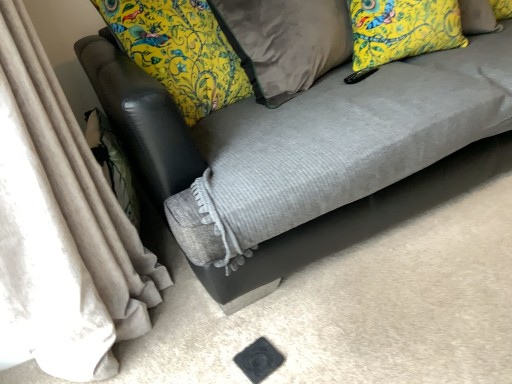
Identify the location of velvet brown pillow at center, the 2th pillow in the right-to-left sequence. Image resolution: width=512 pixels, height=384 pixels. (285, 42).

The height and width of the screenshot is (384, 512). Describe the element at coordinates (285, 42) in the screenshot. I see `velvet brown pillow at center, the 2th pillow in the right-to-left sequence` at that location.

Find the location of a particular element. Image resolution: width=512 pixels, height=384 pixels. velvet gray curtain at left is located at coordinates (61, 227).

Measure the distance between point (x=194, y=176) and camera.

Point (x=194, y=176) is 1.15 meters away from camera.

Find the location of a particular element. This screenshot has width=512, height=384. velvet brown pillow at center, the 2th pillow in the right-to-left sequence is located at coordinates (285, 42).

Considering the relative positions of textured gray couch at center and yellow floral fabric pillow at upper right, the 2th pillow positioned from the left, in the image provided, is textured gray couch at center to the left of yellow floral fabric pillow at upper right, the 2th pillow positioned from the left, from the viewer's perspective?

Incorrect, textured gray couch at center is not on the left side of yellow floral fabric pillow at upper right, the 2th pillow positioned from the left.

Who is taller, textured gray couch at center or yellow floral fabric pillow at upper right, the 1th pillow viewed from the right?

textured gray couch at center is taller.

Which point is more distant from viewer, [170,218] or [387,30]?

The point [387,30] is farther.

Which of these two, velvet gray curtain at left or textured gray couch at center, is wider?

textured gray couch at center is wider.

Is velvet gray curtain at left facing away from textured gray couch at center?

velvet gray curtain at left is not turned away from textured gray couch at center.

From a real-world perspective, is velvet gray curtain at left over textured gray couch at center?

Correct, in the physical world, velvet gray curtain at left is higher than textured gray couch at center.

Is velvet gray curtain at left at the right side of textured gray couch at center?

No, velvet gray curtain at left is not to the right of textured gray couch at center.

Is velvet brown pillow at center, the 2th pillow in the right-to-left sequence, facing away from yellow floral fabric pillow at upper right, the 1th pillow viewed from the right?

That's not correct — velvet brown pillow at center, the 2th pillow in the right-to-left sequence, is not looking away from yellow floral fabric pillow at upper right, the 1th pillow viewed from the right.

Based on the photo, what's the angular difference between velvet brown pillow at center, the 2th pillow in the right-to-left sequence, and yellow floral fabric pillow at upper right, the 1th pillow viewed from the right,'s facing directions?

There is a 41.3-degree angle between the facing directions of velvet brown pillow at center, the 2th pillow in the right-to-left sequence, and yellow floral fabric pillow at upper right, the 1th pillow viewed from the right.

Consider the image. From a real-world perspective, between velvet brown pillow at center, marked as the 1th pillow in a left-to-right arrangement, and yellow floral fabric pillow at upper right, the 2th pillow positioned from the left, who is vertically higher?

yellow floral fabric pillow at upper right, the 2th pillow positioned from the left, is physically above.

Considering the relative sizes of velvet brown pillow at center, the 2th pillow in the right-to-left sequence, and yellow floral fabric pillow at upper right, the 1th pillow viewed from the right, in the image provided, is velvet brown pillow at center, the 2th pillow in the right-to-left sequence, shorter than yellow floral fabric pillow at upper right, the 1th pillow viewed from the right,?

No, velvet brown pillow at center, the 2th pillow in the right-to-left sequence, is not shorter than yellow floral fabric pillow at upper right, the 1th pillow viewed from the right.

Looking at the image, does yellow floral fabric pillow at upper right, the 2th pillow positioned from the left, seem bigger or smaller compared to velvet gray curtain at left?

yellow floral fabric pillow at upper right, the 2th pillow positioned from the left, is smaller than velvet gray curtain at left.

Considering the sizes of yellow floral fabric pillow at upper right, the 2th pillow positioned from the left, and velvet gray curtain at left in the image, is yellow floral fabric pillow at upper right, the 2th pillow positioned from the left, taller or shorter than velvet gray curtain at left?

Considering their sizes, yellow floral fabric pillow at upper right, the 2th pillow positioned from the left, has less height than velvet gray curtain at left.

How different are the orientations of yellow floral fabric pillow at upper right, the 1th pillow viewed from the right, and velvet gray curtain at left in degrees?

There is a 99.7-degree angle between the facing directions of yellow floral fabric pillow at upper right, the 1th pillow viewed from the right, and velvet gray curtain at left.

Would you consider yellow floral fabric pillow at upper right, the 2th pillow positioned from the left, to be distant from velvet gray curtain at left?

Absolutely, yellow floral fabric pillow at upper right, the 2th pillow positioned from the left, is distant from velvet gray curtain at left.

Based on their positions, is yellow floral fabric pillow at upper right, the 2th pillow positioned from the left, located to the left or right of textured gray couch at center?

Based on their positions, yellow floral fabric pillow at upper right, the 2th pillow positioned from the left, is located to the left of textured gray couch at center.

Consider the image. Is the position of yellow floral fabric pillow at upper right, the 2th pillow positioned from the left, less distant than that of textured gray couch at center?

No, it is behind textured gray couch at center.

Is yellow floral fabric pillow at upper right, the 1th pillow viewed from the right, bigger than textured gray couch at center?

No, yellow floral fabric pillow at upper right, the 1th pillow viewed from the right, is not bigger than textured gray couch at center.

Is yellow floral fabric pillow at upper right, the 2th pillow positioned from the left, far away from textured gray couch at center?

No.

What's the angular difference between textured gray couch at center and velvet brown pillow at center, marked as the 1th pillow in a left-to-right arrangement,'s facing directions?

The angle between the facing direction of textured gray couch at center and the facing direction of velvet brown pillow at center, marked as the 1th pillow in a left-to-right arrangement, is 28.2 degrees.

Does textured gray couch at center turn towards velvet brown pillow at center, the 2th pillow in the right-to-left sequence?

Yes, textured gray couch at center is oriented towards velvet brown pillow at center, the 2th pillow in the right-to-left sequence.

Which is closer, (396,143) or (268,42)?

Point (396,143).

Can you confirm if textured gray couch at center is positioned to the right of velvet brown pillow at center, marked as the 1th pillow in a left-to-right arrangement?

Indeed, textured gray couch at center is positioned on the right side of velvet brown pillow at center, marked as the 1th pillow in a left-to-right arrangement.

Is point (411, 25) closer or farther from the camera than point (257, 65)?

Point (411, 25).

Considering their positions, is yellow floral fabric pillow at upper right, the 1th pillow viewed from the right, located in front of or behind velvet brown pillow at center, marked as the 1th pillow in a left-to-right arrangement?

In the image, yellow floral fabric pillow at upper right, the 1th pillow viewed from the right, appears behind velvet brown pillow at center, marked as the 1th pillow in a left-to-right arrangement.

You are a GUI agent. You are given a task and a screenshot of the screen. Output one action in this format:
    pyautogui.click(x=<x>, y=<y>)
    Task: Click on the pillow that is above the velvet brown pillow at center, the 2th pillow in the right-to-left sequence (from the image's perspective)
    
    Given the screenshot: What is the action you would take?
    pyautogui.click(x=402, y=29)

This screenshot has height=384, width=512. Find the location of `the 2nd pillow above the textured gray couch at center (from a real-world perspective)`. the 2nd pillow above the textured gray couch at center (from a real-world perspective) is located at coordinates (402, 29).

At what (x,y) coordinates should I click in order to perform the action: click on studio couch lying above the velvet gray curtain at left (from the image's perspective). Please return your answer as a coordinate pair (x, y). This screenshot has width=512, height=384. Looking at the image, I should click on (310, 152).

Looking at the image, which one is located closer to yellow floral fabric pillow at upper right, the 1th pillow viewed from the right, textured gray couch at center or velvet brown pillow at center, the 2th pillow in the right-to-left sequence?

velvet brown pillow at center, the 2th pillow in the right-to-left sequence, lies closer to yellow floral fabric pillow at upper right, the 1th pillow viewed from the right, than the other object.

Estimate the real-world distances between objects in this image. Which object is further from textured gray couch at center, yellow floral fabric pillow at upper right, the 2th pillow positioned from the left, or velvet brown pillow at center, marked as the 1th pillow in a left-to-right arrangement?

Based on the image, yellow floral fabric pillow at upper right, the 2th pillow positioned from the left, appears to be further to textured gray couch at center.

Looking at the image, which one is located closer to velvet brown pillow at center, marked as the 1th pillow in a left-to-right arrangement, velvet gray curtain at left or yellow floral fabric pillow at upper right, the 2th pillow positioned from the left?

yellow floral fabric pillow at upper right, the 2th pillow positioned from the left, lies closer to velvet brown pillow at center, marked as the 1th pillow in a left-to-right arrangement, than the other object.

Which object lies nearer to the anchor point textured gray couch at center, velvet gray curtain at left or velvet brown pillow at center, marked as the 1th pillow in a left-to-right arrangement?

velvet brown pillow at center, marked as the 1th pillow in a left-to-right arrangement.

When comparing their distances from velvet gray curtain at left, does yellow floral fabric pillow at upper right, the 2th pillow positioned from the left, or velvet brown pillow at center, marked as the 1th pillow in a left-to-right arrangement, seem closer?

velvet brown pillow at center, marked as the 1th pillow in a left-to-right arrangement, is positioned closer to the anchor velvet gray curtain at left.

Based on their spatial positions, is yellow floral fabric pillow at upper right, the 2th pillow positioned from the left, or textured gray couch at center closer to velvet gray curtain at left?

textured gray couch at center is closer to velvet gray curtain at left.

Estimate the real-world distances between objects in this image. Which object is further from textured gray couch at center, velvet brown pillow at center, the 2th pillow in the right-to-left sequence, or yellow floral fabric pillow at upper right, the 1th pillow viewed from the right?

Based on the image, yellow floral fabric pillow at upper right, the 1th pillow viewed from the right, appears to be further to textured gray couch at center.

Estimate the real-world distances between objects in this image. Which object is further from velvet gray curtain at left, velvet brown pillow at center, marked as the 1th pillow in a left-to-right arrangement, or textured gray couch at center?

velvet brown pillow at center, marked as the 1th pillow in a left-to-right arrangement, lies further to velvet gray curtain at left than the other object.

Find the location of a particular element. pillow between velvet gray curtain at left and yellow floral fabric pillow at upper right, the 1th pillow viewed from the right is located at coordinates (285, 42).

This screenshot has width=512, height=384. What are the coordinates of `pillow positioned between textured gray couch at center and yellow floral fabric pillow at upper right, the 1th pillow viewed from the right, from near to far` in the screenshot? It's located at (285, 42).